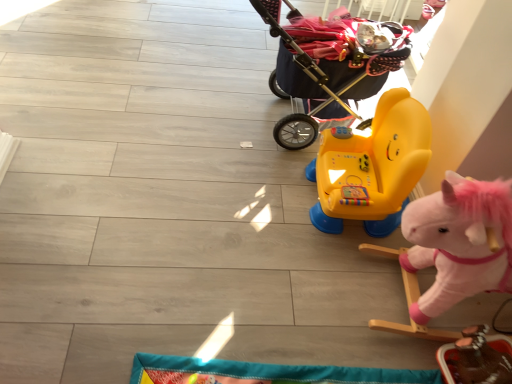
What do you see at coordinates (445, 259) in the screenshot?
I see `fluffy pink rocking horse at right, the 2th toy when ordered from bottom to top` at bounding box center [445, 259].

The width and height of the screenshot is (512, 384). What do you see at coordinates (333, 60) in the screenshot?
I see `dark blue fabric baby carriage at upper right` at bounding box center [333, 60].

Locate an element on the screen. The width and height of the screenshot is (512, 384). yellow plastic ride-on toy at center, arranged as the 3th toy when ordered from the bottom is located at coordinates (371, 167).

Between smooth brown wooden toy at lower right, which is the 3th toy in top-to-bottom order, and fluffy pink rocking horse at right, the second toy when ordered from top to bottom, which one has larger size?

fluffy pink rocking horse at right, the second toy when ordered from top to bottom, is bigger.

Considering the positions of points (454, 370) and (431, 209), is point (454, 370) closer to camera compared to point (431, 209)?

No, (454, 370) is further to viewer.

Is point (315, 134) positioned behind point (385, 201)?

Yes, point (315, 134) is farther from viewer.

From the image's perspective, would you say dark blue fabric baby carriage at upper right is shown under yellow plastic ride-on toy at center, arranged as the 3th toy when ordered from the bottom?

No, from the image's perspective, dark blue fabric baby carriage at upper right is not beneath yellow plastic ride-on toy at center, arranged as the 3th toy when ordered from the bottom.

How far apart are dark blue fabric baby carriage at upper right and yellow plastic ride-on toy at center, arranged as the 3th toy when ordered from the bottom?

dark blue fabric baby carriage at upper right and yellow plastic ride-on toy at center, arranged as the 3th toy when ordered from the bottom, are 12.02 inches apart.

Which object is wider, dark blue fabric baby carriage at upper right or yellow plastic ride-on toy at center, arranged as the 3th toy when ordered from the bottom?

Wider between the two is dark blue fabric baby carriage at upper right.

Does fluffy pink rocking horse at right, the 2th toy when ordered from bottom to top, appear on the left side of yellow plastic ride-on toy at center, the 1th toy positioned from the top?

No, fluffy pink rocking horse at right, the 2th toy when ordered from bottom to top, is not to the left of yellow plastic ride-on toy at center, the 1th toy positioned from the top.

Between point (441, 188) and point (412, 106), which one is positioned in front?

The point (412, 106) is closer to the camera.

Is fluffy pink rocking horse at right, the second toy when ordered from top to bottom, located outside yellow plastic ride-on toy at center, arranged as the 3th toy when ordered from the bottom?

Yes, fluffy pink rocking horse at right, the second toy when ordered from top to bottom, is located beyond the bounds of yellow plastic ride-on toy at center, arranged as the 3th toy when ordered from the bottom.

From the image's perspective, is fluffy pink rocking horse at right, the 2th toy when ordered from bottom to top, located above yellow plastic ride-on toy at center, the 1th toy positioned from the top?

Incorrect, from the image's perspective, fluffy pink rocking horse at right, the 2th toy when ordered from bottom to top, is lower than yellow plastic ride-on toy at center, the 1th toy positioned from the top.

Which is less distant, (x=424, y=169) or (x=511, y=357)?

The point (x=511, y=357) is closer.

Can you tell me how much yellow plastic ride-on toy at center, the 1th toy positioned from the top, and smooth brown wooden toy at lower right, placed as the first toy when sorted from bottom to top, differ in facing direction?

They differ by 1.54 degrees in their facing directions.

Is yellow plastic ride-on toy at center, arranged as the 3th toy when ordered from the bottom, far from smooth brown wooden toy at lower right, placed as the first toy when sorted from bottom to top?

No, yellow plastic ride-on toy at center, arranged as the 3th toy when ordered from the bottom, is in close proximity to smooth brown wooden toy at lower right, placed as the first toy when sorted from bottom to top.

Looking at this image, considering the relative sizes of yellow plastic ride-on toy at center, arranged as the 3th toy when ordered from the bottom, and smooth brown wooden toy at lower right, placed as the first toy when sorted from bottom to top, in the image provided, is yellow plastic ride-on toy at center, arranged as the 3th toy when ordered from the bottom, smaller than smooth brown wooden toy at lower right, placed as the first toy when sorted from bottom to top,?

Actually, yellow plastic ride-on toy at center, arranged as the 3th toy when ordered from the bottom, might be larger than smooth brown wooden toy at lower right, placed as the first toy when sorted from bottom to top.

At what (x,y) coordinates should I click in order to perform the action: click on toy that is the 3rd one when counting downward from the dark blue fabric baby carriage at upper right (from the image's perspective). Please return your answer as a coordinate pair (x, y). Looking at the image, I should click on (476, 358).

Is dark blue fabric baby carriage at upper right behind smooth brown wooden toy at lower right, which is the 3th toy in top-to-bottom order?

That is True.

From the image's perspective, which one is positioned higher, dark blue fabric baby carriage at upper right or smooth brown wooden toy at lower right, placed as the first toy when sorted from bottom to top?

dark blue fabric baby carriage at upper right.

From the picture: From a real-world perspective, which object rests below the other?

smooth brown wooden toy at lower right, which is the 3th toy in top-to-bottom order, from a real-world perspective.

Between smooth brown wooden toy at lower right, placed as the first toy when sorted from bottom to top, and yellow plastic ride-on toy at center, arranged as the 3th toy when ordered from the bottom, which one has more height?

With more height is yellow plastic ride-on toy at center, arranged as the 3th toy when ordered from the bottom.

Does smooth brown wooden toy at lower right, placed as the first toy when sorted from bottom to top, have a smaller size compared to yellow plastic ride-on toy at center, the 1th toy positioned from the top?

Yes, smooth brown wooden toy at lower right, placed as the first toy when sorted from bottom to top, is smaller than yellow plastic ride-on toy at center, the 1th toy positioned from the top.

Between smooth brown wooden toy at lower right, placed as the first toy when sorted from bottom to top, and yellow plastic ride-on toy at center, arranged as the 3th toy when ordered from the bottom, which one has larger width?

Wider between the two is yellow plastic ride-on toy at center, arranged as the 3th toy when ordered from the bottom.

Considering the relative positions of smooth brown wooden toy at lower right, placed as the first toy when sorted from bottom to top, and yellow plastic ride-on toy at center, the 1th toy positioned from the top, in the image provided, is smooth brown wooden toy at lower right, placed as the first toy when sorted from bottom to top, behind yellow plastic ride-on toy at center, the 1th toy positioned from the top,?

No, it is not.

Does dark blue fabric baby carriage at upper right have a smaller size compared to fluffy pink rocking horse at right, the 2th toy when ordered from bottom to top?

No.

Is dark blue fabric baby carriage at upper right next to fluffy pink rocking horse at right, the second toy when ordered from top to bottom?

No, dark blue fabric baby carriage at upper right is not in contact with fluffy pink rocking horse at right, the second toy when ordered from top to bottom.

How different are the orientations of dark blue fabric baby carriage at upper right and fluffy pink rocking horse at right, the second toy when ordered from top to bottom, in degrees?

0.000882 degrees.

Can you confirm if dark blue fabric baby carriage at upper right is wider than fluffy pink rocking horse at right, the 2th toy when ordered from bottom to top?

Correct, the width of dark blue fabric baby carriage at upper right exceeds that of fluffy pink rocking horse at right, the 2th toy when ordered from bottom to top.

Find the location of `toy in front of the smooth brown wooden toy at lower right, which is the 3th toy in top-to-bottom order`. toy in front of the smooth brown wooden toy at lower right, which is the 3th toy in top-to-bottom order is located at coordinates (445, 259).

Find the location of a particular element. The height and width of the screenshot is (384, 512). baby carriage that appears on the left of yellow plastic ride-on toy at center, the 1th toy positioned from the top is located at coordinates (333, 60).

Consider the image. Based on their spatial positions, is fluffy pink rocking horse at right, the 2th toy when ordered from bottom to top, or smooth brown wooden toy at lower right, which is the 3th toy in top-to-bottom order, further from yellow plastic ride-on toy at center, arranged as the 3th toy when ordered from the bottom?

smooth brown wooden toy at lower right, which is the 3th toy in top-to-bottom order.

Considering their positions, is fluffy pink rocking horse at right, the second toy when ordered from top to bottom, positioned further to dark blue fabric baby carriage at upper right than smooth brown wooden toy at lower right, placed as the first toy when sorted from bottom to top?

Based on the image, smooth brown wooden toy at lower right, placed as the first toy when sorted from bottom to top, appears to be further to dark blue fabric baby carriage at upper right.

Which object lies further to the anchor point dark blue fabric baby carriage at upper right, yellow plastic ride-on toy at center, the 1th toy positioned from the top, or smooth brown wooden toy at lower right, which is the 3th toy in top-to-bottom order?

smooth brown wooden toy at lower right, which is the 3th toy in top-to-bottom order, lies further to dark blue fabric baby carriage at upper right than the other object.

From the image, which object appears to be farther from yellow plastic ride-on toy at center, arranged as the 3th toy when ordered from the bottom, fluffy pink rocking horse at right, the second toy when ordered from top to bottom, or dark blue fabric baby carriage at upper right?

dark blue fabric baby carriage at upper right is positioned further to the anchor yellow plastic ride-on toy at center, arranged as the 3th toy when ordered from the bottom.

From the image, which object appears to be farther from smooth brown wooden toy at lower right, which is the 3th toy in top-to-bottom order, yellow plastic ride-on toy at center, the 1th toy positioned from the top, or dark blue fabric baby carriage at upper right?

dark blue fabric baby carriage at upper right is positioned further to the anchor smooth brown wooden toy at lower right, which is the 3th toy in top-to-bottom order.

In the scene shown: Looking at the image, which one is located further to fluffy pink rocking horse at right, the 2th toy when ordered from bottom to top, dark blue fabric baby carriage at upper right or smooth brown wooden toy at lower right, placed as the first toy when sorted from bottom to top?

dark blue fabric baby carriage at upper right.

Considering their positions, is smooth brown wooden toy at lower right, placed as the first toy when sorted from bottom to top, positioned closer to fluffy pink rocking horse at right, the 2th toy when ordered from bottom to top, than dark blue fabric baby carriage at upper right?

smooth brown wooden toy at lower right, placed as the first toy when sorted from bottom to top, is positioned closer to the anchor fluffy pink rocking horse at right, the 2th toy when ordered from bottom to top.

Looking at the image, which one is located closer to yellow plastic ride-on toy at center, arranged as the 3th toy when ordered from the bottom, smooth brown wooden toy at lower right, which is the 3th toy in top-to-bottom order, or fluffy pink rocking horse at right, the 2th toy when ordered from bottom to top?

fluffy pink rocking horse at right, the 2th toy when ordered from bottom to top, is positioned closer to the anchor yellow plastic ride-on toy at center, arranged as the 3th toy when ordered from the bottom.

Image resolution: width=512 pixels, height=384 pixels. Identify the location of toy between yellow plastic ride-on toy at center, the 1th toy positioned from the top, and smooth brown wooden toy at lower right, placed as the first toy when sorted from bottom to top, from top to bottom. (445, 259).

What are the coordinates of `toy between dark blue fabric baby carriage at upper right and fluffy pink rocking horse at right, the second toy when ordered from top to bottom, in the vertical direction` in the screenshot? It's located at (371, 167).